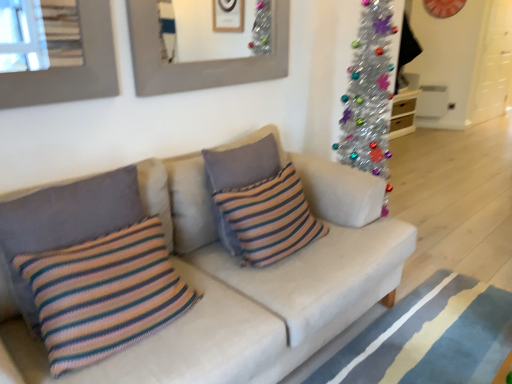
Question: From the image's perspective, relative to blue striped rug at lower right, is white fabric couch at center above or below?

Choices:
 (A) below
 (B) above

Answer: (B)

Question: Looking at their shapes, would you say white fabric couch at center is wider or thinner than blue striped rug at lower right?

Choices:
 (A) wide
 (B) thin

Answer: (B)

Question: Which object is the closest to the knitted multicolored pillow at left, positioned as the second pillow in front-to-back order?

Choices:
 (A) knitted striped pillow at center, marked as the first pillow in a back-to-front arrangement
 (B) knitted striped pillow at center, the 3th pillow from the back
 (C) white fabric couch at center
 (D) matte gray picture frame at upper center
 (E) blue striped rug at lower right

Answer: (B)

Question: Which object is the closest to the knitted striped pillow at center, the 1th pillow viewed from the front?

Choices:
 (A) matte gray picture frame at upper center
 (B) knitted striped pillow at center, arranged as the third pillow when viewed from the front
 (C) white fabric couch at center
 (D) blue striped rug at lower right
 (E) knitted multicolored pillow at left, the 2th pillow when ordered from back to front

Answer: (E)